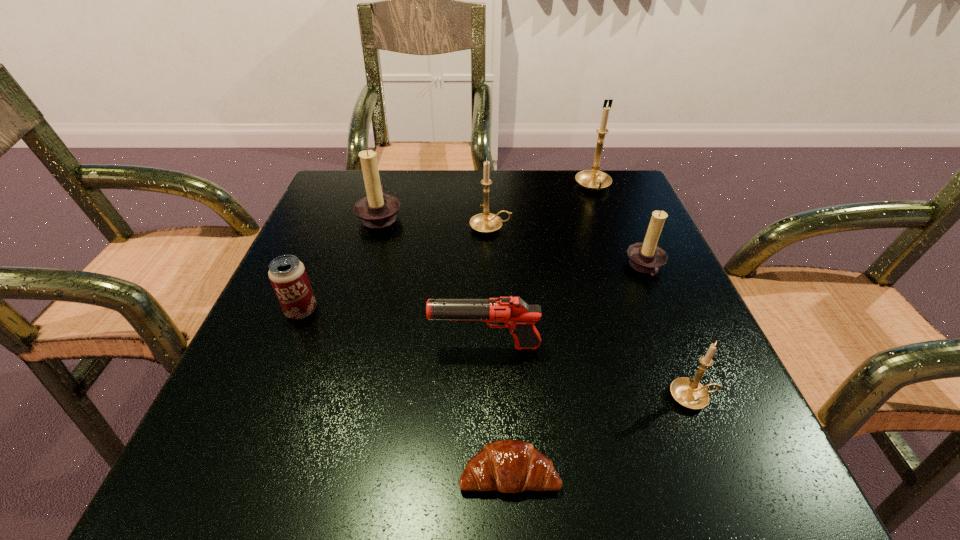
Find the location of `empty location between the second farthest gold candle holder and the nearest object`. empty location between the second farthest gold candle holder and the nearest object is located at coordinates pos(500,350).

Locate an element on the screen. The width and height of the screenshot is (960, 540). vacant region between the gun and the leftmost gold candle holder is located at coordinates (488, 287).

Locate an element on the screen. The height and width of the screenshot is (540, 960). unoccupied position between the second biggest gold candle holder and the biggest gold candle holder is located at coordinates (542, 207).

Where is `free space between the gun and the left brown candle holder`? This screenshot has width=960, height=540. free space between the gun and the left brown candle holder is located at coordinates (433, 281).

What are the coordinates of `empty space between the leftmost object and the second farthest gold candle holder` in the screenshot? It's located at (396, 269).

Locate an element on the screen. The width and height of the screenshot is (960, 540). vacant area that lies between the tallest object and the sixth farthest object is located at coordinates (540, 267).

Where is `free point between the second biggest gold candle holder and the fourth nearest object`? The width and height of the screenshot is (960, 540). free point between the second biggest gold candle holder and the fourth nearest object is located at coordinates (396, 269).

Where is `free space between the farthest gold candle holder and the sixth farthest object`? Image resolution: width=960 pixels, height=540 pixels. free space between the farthest gold candle holder and the sixth farthest object is located at coordinates (540, 267).

Locate an element on the screen. This screenshot has height=540, width=960. free space between the tallest object and the leftmost object is located at coordinates [x=447, y=249].

Locate which object ranks seventh in proximity to the second farthest gold candle holder. Please provide its 2D coordinates. Your answer should be formatted as a tuple, i.e. [(x, y)], where the tuple contains the x and y coordinates of a point satisfying the conditions above.

[(510, 466)]